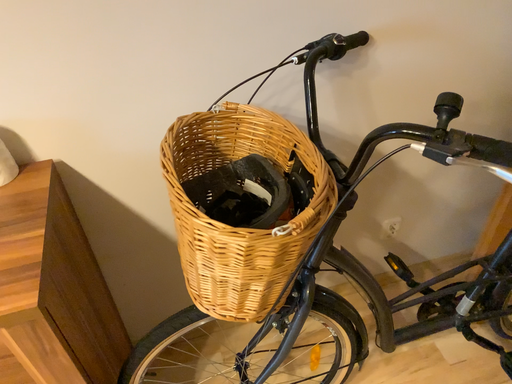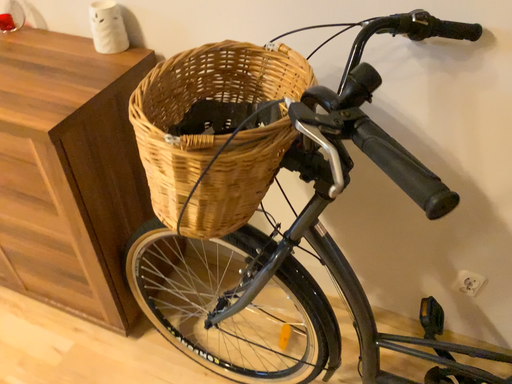
Question: How did the camera likely rotate when shooting the video?

Choices:
 (A) rotated left
 (B) rotated right

Answer: (A)